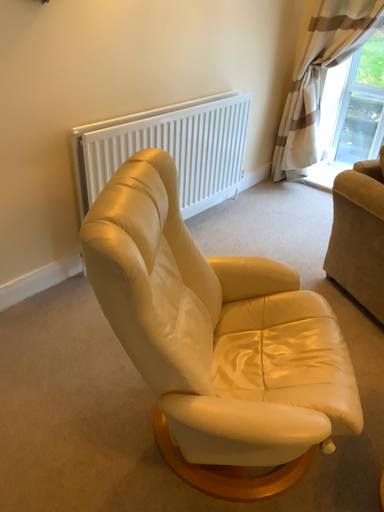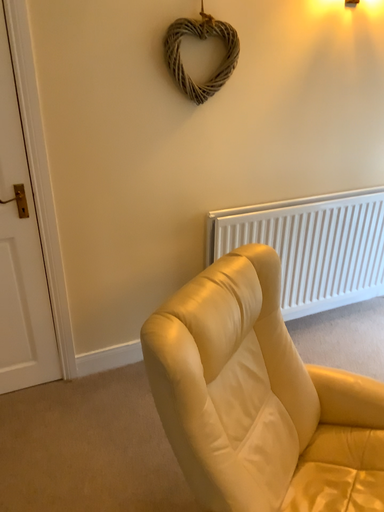
Question: How did the camera likely rotate when shooting the video?

Choices:
 (A) rotated left
 (B) rotated right

Answer: (A)